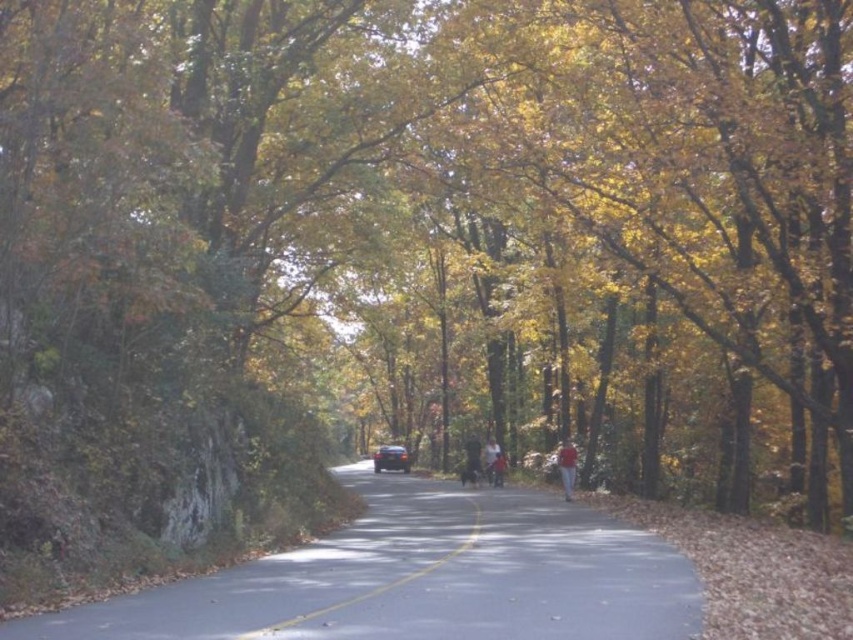
Question: Which of the following is the farthest from the observer?

Choices:
 (A) red fabric person at center
 (B) smooth asphalt road at center
 (C) shiny black car at center
 (D) dark gray fabric jacket at center

Answer: (C)

Question: From the image, what is the correct spatial relationship of red fabric person at center in relation to dark gray fabric jacket at center?

Choices:
 (A) below
 (B) above

Answer: (B)

Question: Can you confirm if smooth asphalt road at center is positioned to the left of dark gray fabric jacket at center?

Choices:
 (A) yes
 (B) no

Answer: (A)

Question: In this image, where is shiny black car at center located relative to dark gray fabric jacket at center?

Choices:
 (A) above
 (B) below

Answer: (B)

Question: Which point is closer to the camera?

Choices:
 (A) smooth asphalt road at center
 (B) dark gray fabric jacket at center
 (C) shiny black car at center
 (D) red fabric person at center

Answer: (A)

Question: Which of the following is the closest to the observer?

Choices:
 (A) (260, 634)
 (B) (381, 461)

Answer: (A)